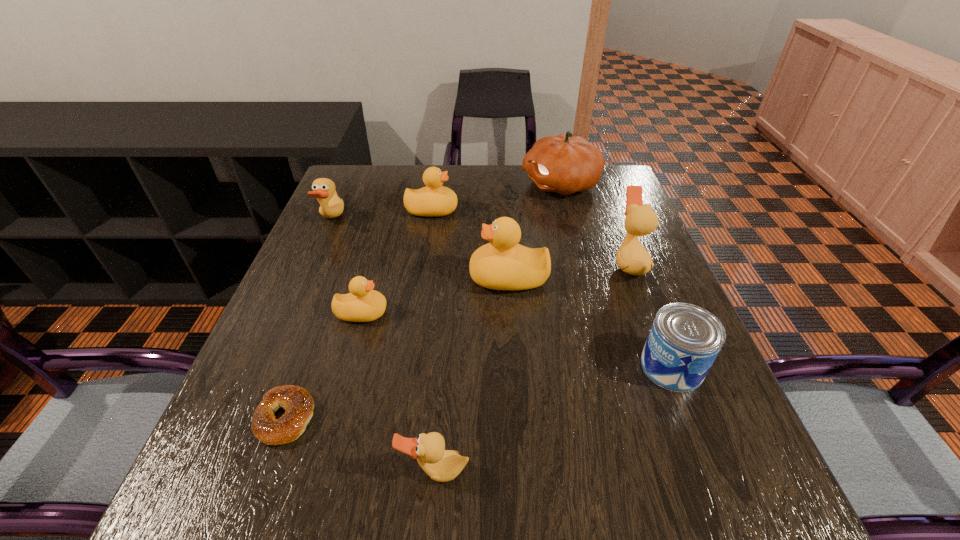
Identify the location of vacant point that satisfies the following two spatial constraints: 1. on the front label of the blue can; 2. on the beak of the nearest duck. This screenshot has width=960, height=540. (713, 471).

Where is `free space that satisfies the following two spatial constraints: 1. on the beak of the bagel; 2. on the right side of the leftmost tan duck`? The height and width of the screenshot is (540, 960). free space that satisfies the following two spatial constraints: 1. on the beak of the bagel; 2. on the right side of the leftmost tan duck is located at coordinates (246, 417).

Identify the location of vacant area in the image that satisfies the following two spatial constraints: 1. on the beak of the second nearest tan duck; 2. on the beak of the nearest tan duck. (709, 471).

Identify the location of free space that satisfies the following two spatial constraints: 1. on the front label of the can; 2. on the front side of the bagel. Image resolution: width=960 pixels, height=540 pixels. (692, 417).